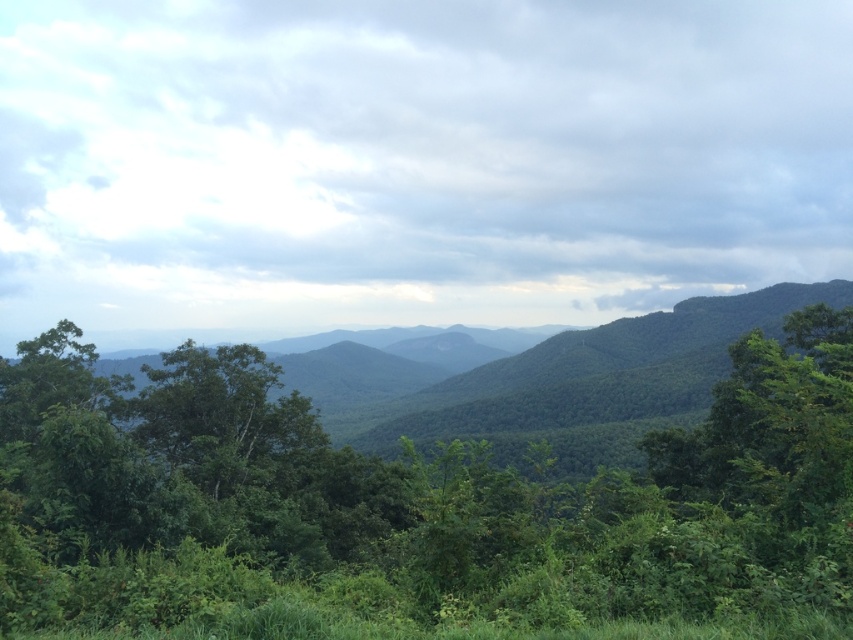
You are an environmental scientist studying the vegetation in this mountainous area. You observe the green leafy forest at center and the green leafy tree at center. Which of these two has a greater width?

The green leafy forest at center has a greater width than the green leafy tree at center according to the description provided.

You are an environmental scientist studying the mountainous landscape. You observe the green leafy forest at center and the green leafy tree at center. Which of these two has a lower position in the image?

The green leafy forest at center is positioned under the green leafy tree at center, so the forest is lower in the image.

You are a hiker standing in the lush mountainous landscape. You notice the green leafy forest at center and the green leafy tree at center. Which one appears taller from your viewpoint?

The green leafy forest at center appears taller than the green leafy tree at center because it has a greater height compared to it.